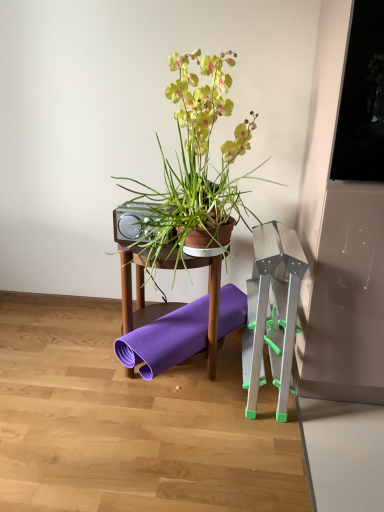
Question: Considering the relative sizes of wooden table at center and matte brown pot at center in the image provided, is wooden table at center bigger than matte brown pot at center?

Choices:
 (A) yes
 (B) no

Answer: (B)

Question: Is wooden table at center looking in the opposite direction of matte brown pot at center?

Choices:
 (A) yes
 (B) no

Answer: (B)

Question: From the image's perspective, is wooden table at center on matte brown pot at center?

Choices:
 (A) no
 (B) yes

Answer: (A)

Question: Is wooden table at center wider than matte brown pot at center?

Choices:
 (A) no
 (B) yes

Answer: (A)

Question: Is the surface of wooden table at center in direct contact with matte brown pot at center?

Choices:
 (A) yes
 (B) no

Answer: (B)

Question: Considering the relative positions of wooden table at center and matte brown pot at center in the image provided, is wooden table at center to the left of matte brown pot at center from the viewer's perspective?

Choices:
 (A) yes
 (B) no

Answer: (A)

Question: Is matte brown pot at center bigger than transparent glass window screen at upper right?

Choices:
 (A) yes
 (B) no

Answer: (A)

Question: Is matte brown pot at center to the left of transparent glass window screen at upper right from the viewer's perspective?

Choices:
 (A) no
 (B) yes

Answer: (B)

Question: Is matte brown pot at center facing away from transparent glass window screen at upper right?

Choices:
 (A) yes
 (B) no

Answer: (B)

Question: Does matte brown pot at center turn towards transparent glass window screen at upper right?

Choices:
 (A) yes
 (B) no

Answer: (B)

Question: Can you confirm if matte brown pot at center is taller than transparent glass window screen at upper right?

Choices:
 (A) no
 (B) yes

Answer: (B)

Question: From the image's perspective, is matte brown pot at center on transparent glass window screen at upper right?

Choices:
 (A) no
 (B) yes

Answer: (A)

Question: Is wooden table at center located outside silver metallic step stool at right?

Choices:
 (A) yes
 (B) no

Answer: (A)